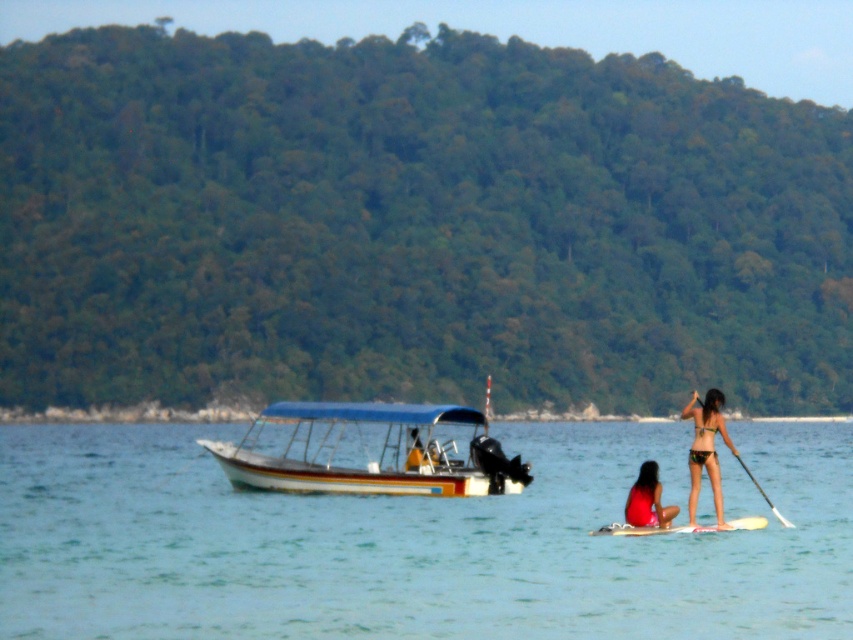
Which is behind, point (312, 404) or point (704, 403)?

Point (312, 404)

Does point (393, 465) come closer to viewer compared to point (780, 522)?

No.

Where is `wooden boat at center`? wooden boat at center is located at coordinates (369, 451).

Describe the element at coordinates (706, 449) in the screenshot. This screenshot has width=853, height=640. I see `matte black bikini at center` at that location.

How distant is matte black bikini at center from white foam surfboard at lower center?

The distance of matte black bikini at center from white foam surfboard at lower center is 34.43 inches.

Who is more forward, (720, 508) or (640, 528)?

Point (720, 508)

Identify the location of matte black bikini at center. Image resolution: width=853 pixels, height=640 pixels. [x=706, y=449].

Is matte black bikini at center further to the viewer compared to matte red swimsuit at lower center?

No, matte black bikini at center is in front of matte red swimsuit at lower center.

Who is shorter, matte black bikini at center or matte red swimsuit at lower center?

With less height is matte red swimsuit at lower center.

Where is `matte black bikini at center`? The image size is (853, 640). matte black bikini at center is located at coordinates (706, 449).

The height and width of the screenshot is (640, 853). I want to click on matte black bikini at center, so click(x=706, y=449).